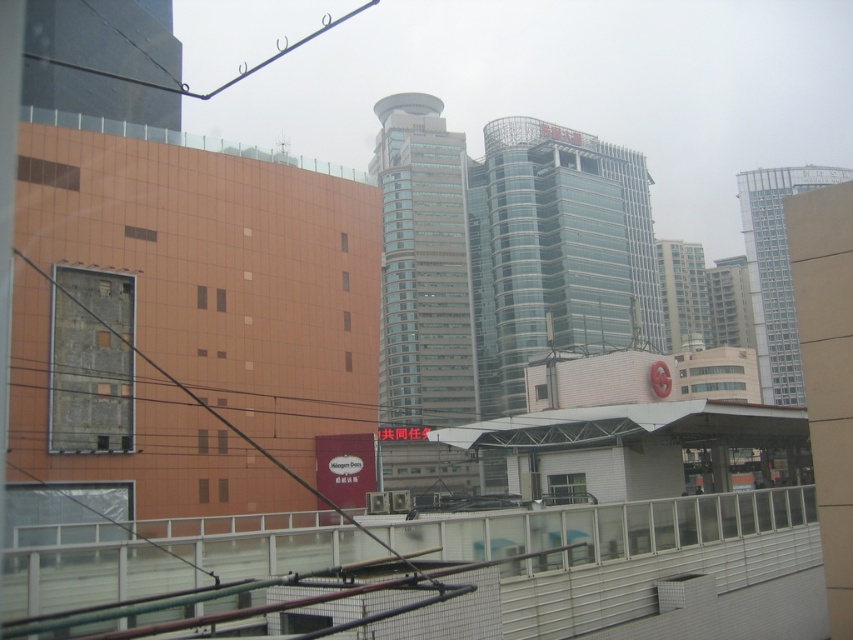
Between point (432, 305) and point (761, 211), which one is positioned behind?

The point (761, 211) is more distant.

Does glassy modern building at center appear over light gray glass tower at right?

Yes, glassy modern building at center is above light gray glass tower at right.

Identify the location of glassy modern building at center. (422, 266).

Which of these two, transparent glass tower at center or glassy modern building at center, stands taller?

glassy modern building at center

Measure the distance between transparent glass tower at center and glassy modern building at center.

The distance of transparent glass tower at center from glassy modern building at center is 49.68 feet.

What are the coordinates of `transparent glass tower at center` in the screenshot? It's located at (556, 252).

Is transparent glass tower at center above light gray glass tower at right?

Actually, transparent glass tower at center is below light gray glass tower at right.

Who is more distant from viewer, (618, 209) or (802, 192)?

Point (802, 192)

This screenshot has height=640, width=853. In order to click on transparent glass tower at center in this screenshot , I will do `click(556, 252)`.